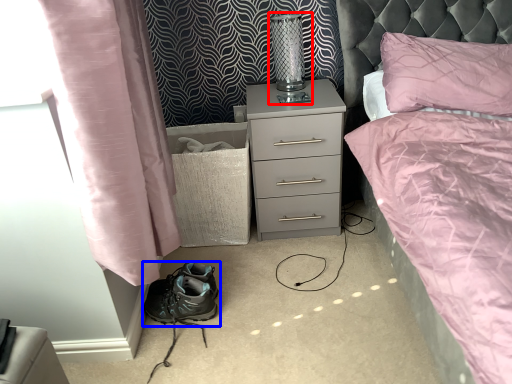
Question: Among these objects, which one is farthest to the camera, bedside lamp (highlighted by a red box) or footwear (highlighted by a blue box)?

Choices:
 (A) bedside lamp
 (B) footwear

Answer: (A)